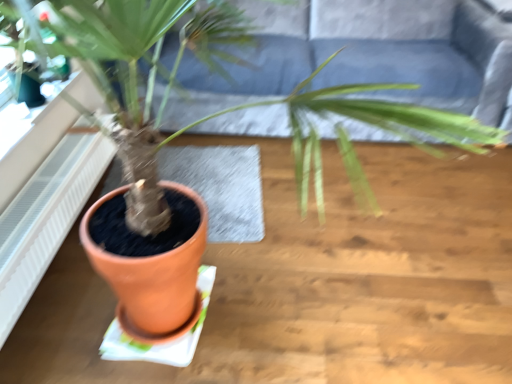
Question: Considering their positions, is white textured radiator at left located in front of or behind dark gray fabric couch at upper center?

Choices:
 (A) behind
 (B) front

Answer: (B)

Question: From a real-world perspective, is white textured radiator at left positioned above or below dark gray fabric couch at upper center?

Choices:
 (A) above
 (B) below

Answer: (B)

Question: Looking at their shapes, would you say white textured radiator at left is wider or thinner than dark gray fabric couch at upper center?

Choices:
 (A) wide
 (B) thin

Answer: (B)

Question: From a real-world perspective, is dark gray fabric couch at upper center positioned above or below white textured radiator at left?

Choices:
 (A) below
 (B) above

Answer: (B)

Question: Is dark gray fabric couch at upper center wider or thinner than white textured radiator at left?

Choices:
 (A) wide
 (B) thin

Answer: (A)

Question: Is dark gray fabric couch at upper center situated inside white textured radiator at left or outside?

Choices:
 (A) outside
 (B) inside

Answer: (A)

Question: Looking at the image, does dark gray fabric couch at upper center seem bigger or smaller compared to white textured radiator at left?

Choices:
 (A) small
 (B) big

Answer: (B)